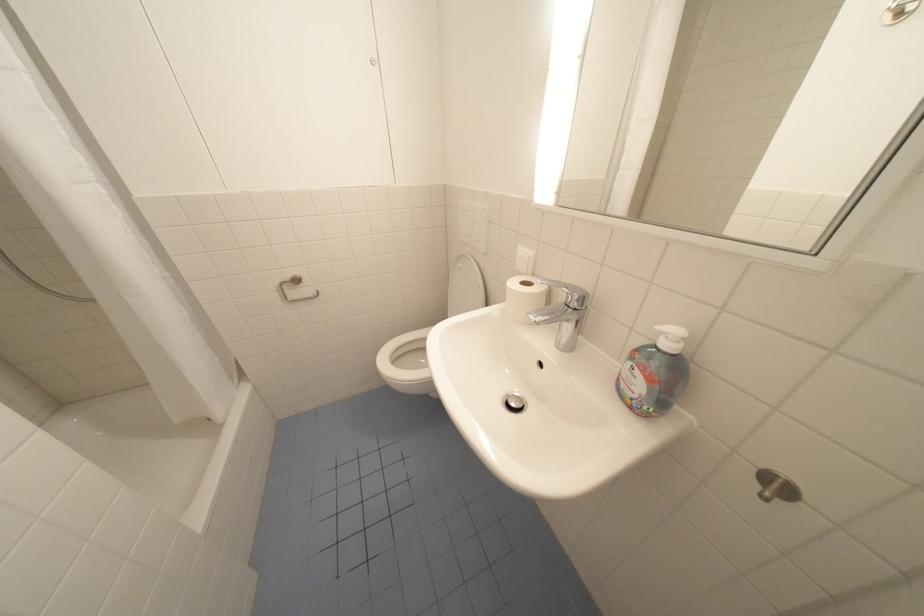
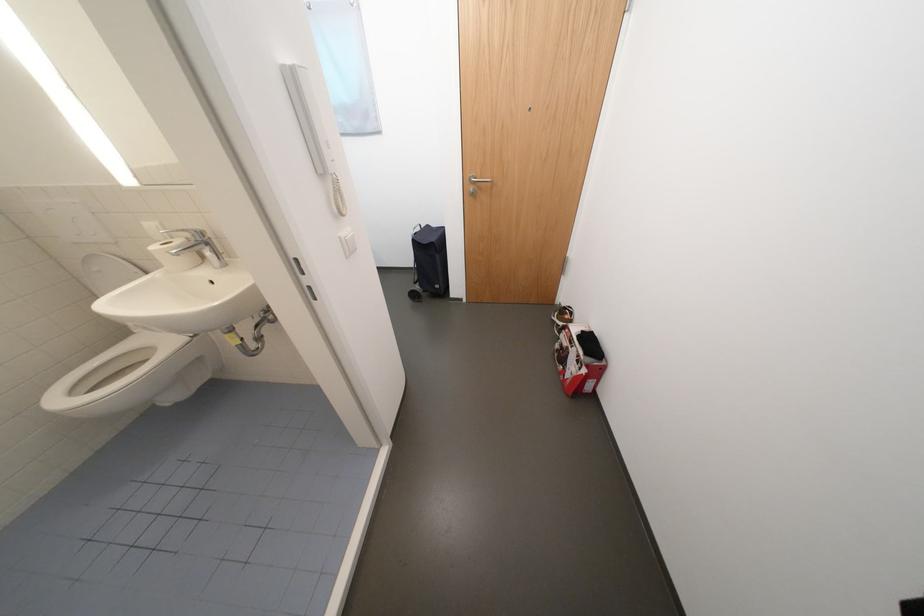
In the second image, find the point that corresponds to the point at 541,276 in the first image.

(179, 238)